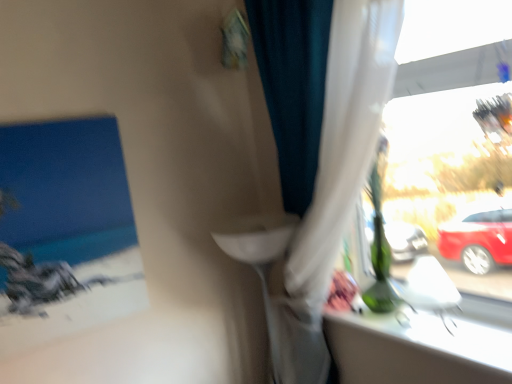
Locate an element on the screen. empty space that is ontop of white glossy window sill at upper right (from a real-world perspective) is located at coordinates (409, 308).